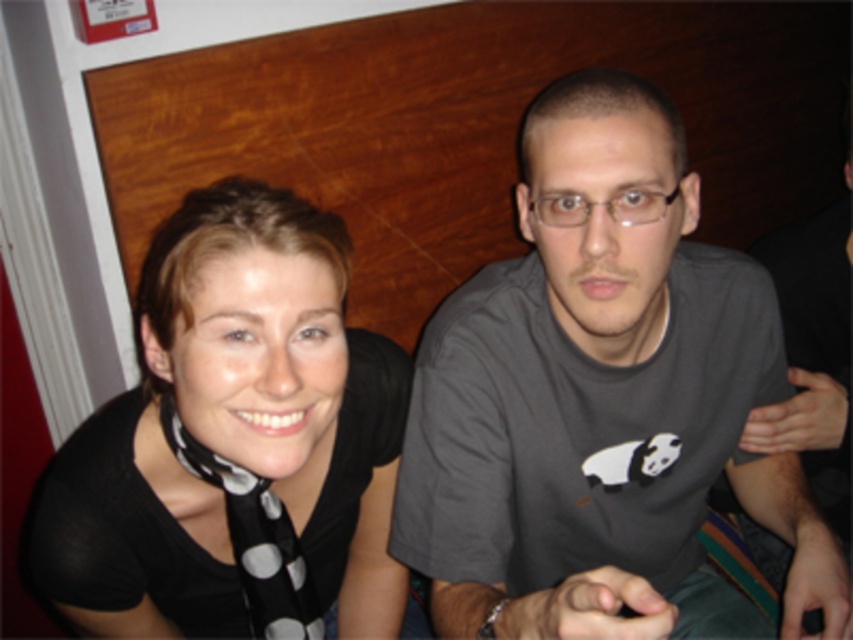
Question: Is gray matte t-shirt at center bigger than black dotted scarf at left?

Choices:
 (A) yes
 (B) no

Answer: (A)

Question: Is gray matte t-shirt at center below black dotted scarf at left?

Choices:
 (A) yes
 (B) no

Answer: (B)

Question: Which point is closer to the camera?

Choices:
 (A) gray matte t-shirt at center
 (B) black dotted scarf at left

Answer: (A)

Question: Which of the following is the closest to the observer?

Choices:
 (A) (167, 346)
 (B) (469, 397)

Answer: (A)

Question: Can you confirm if gray matte t-shirt at center is positioned below black dotted scarf at left?

Choices:
 (A) no
 (B) yes

Answer: (A)